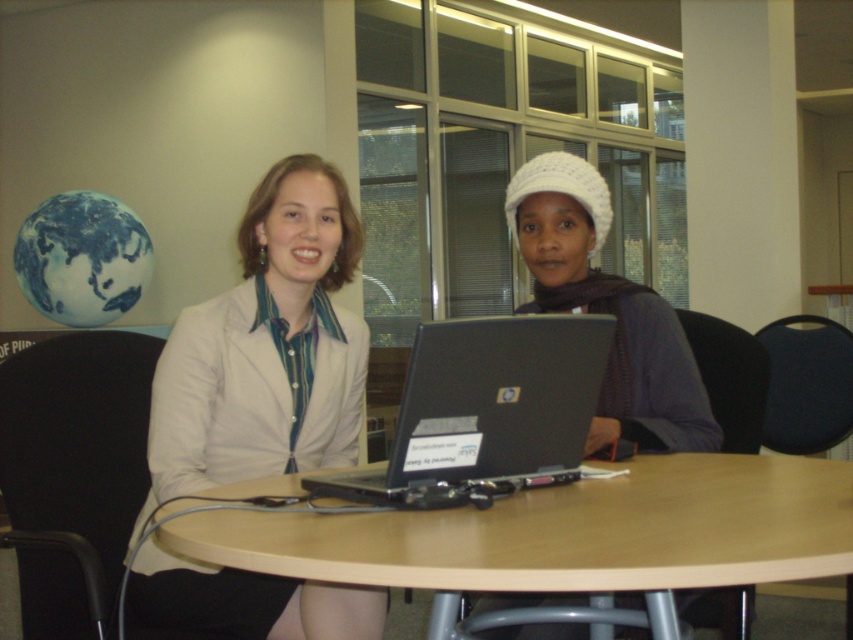
You are a photographer setting up for a portrait session in the office scene. You need to place a small reflector at point [265,348] to bounce light onto the matte white blazer at center. Will placing the reflector at that point effectively illuminate the blazer?

Yes, placing the reflector at point [265,348] will effectively illuminate the matte white blazer at center since the point is exactly where the blazer is located.

Based on the scene described, which object, the wooden at center or the matte white blazer at center, occupies more horizontal space on the table?

The wooden at center is wider than the matte white blazer at center, so it occupies more horizontal space on the table.

You are a photographer setting up for a portrait shoot. You have a matte white blazer at center and a wooden at center in the scene. To ensure both items are visible in the frame, where should you position the camera relative to the subjects?

The wooden at center is to the right of the matte white blazer at center, so positioning the camera to the right side of the subjects will ensure both items are visible in the frame.